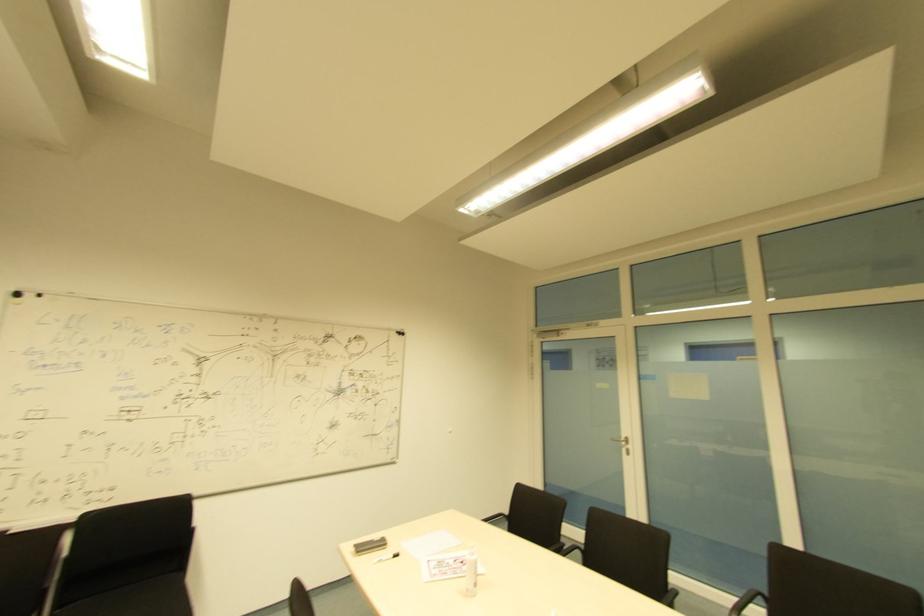
Locate an element on the screen. The image size is (924, 616). silver door handle is located at coordinates (623, 444).